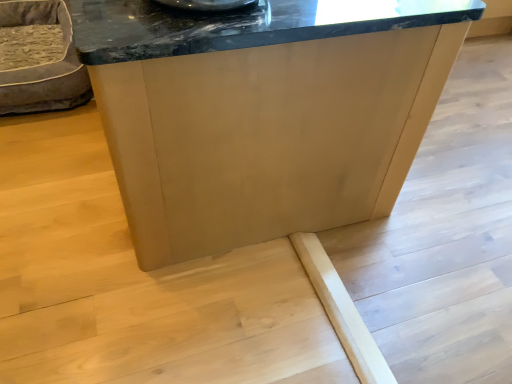
In order to click on vacant area that is in front of matte wood table at center in this screenshot , I will do `click(213, 302)`.